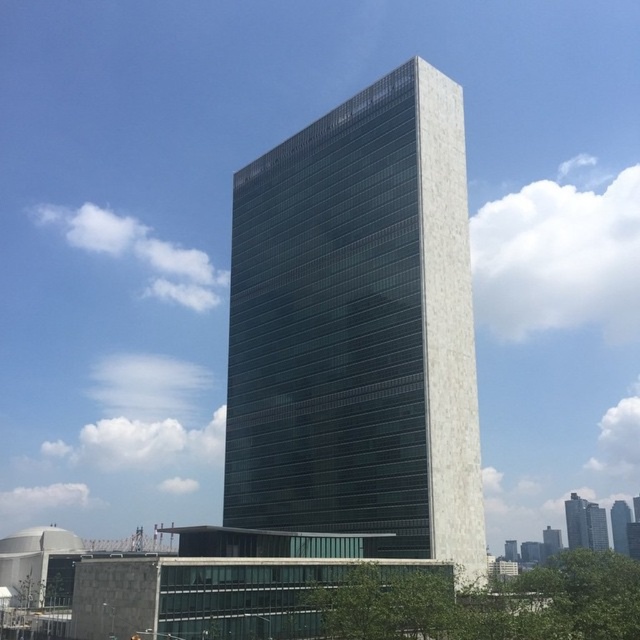
You are an architect evaluating two skyscrapers in the image. The glassy reflective skyscraper at center and the green glass skyscraper at center. Which one is taller?

The green glass skyscraper at center is taller than the glassy reflective skyscraper at center.

You are an architect evaluating the skyline of a city. You observe the white marble tower at center and the green glass skyscraper at center. Which one appears taller from your vantage point?

The green glass skyscraper at center appears taller than the white marble tower at center as it has a greater height.